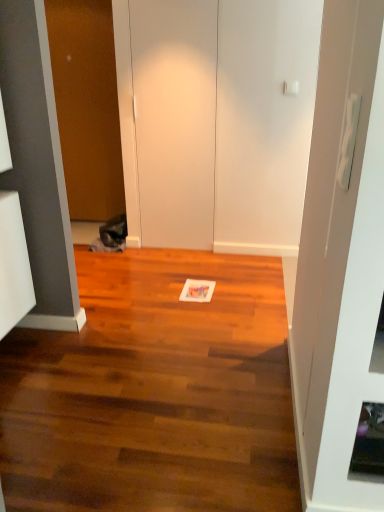
What do you see at coordinates (175, 119) in the screenshot? The height and width of the screenshot is (512, 384). I see `white matte door at center, marked as the 1th door in a right-to-left arrangement` at bounding box center [175, 119].

Where is `white matte door at center, the second door positioned from the left`? This screenshot has height=512, width=384. white matte door at center, the second door positioned from the left is located at coordinates (175, 119).

This screenshot has width=384, height=512. Describe the element at coordinates (87, 106) in the screenshot. I see `wooden door at left, which is counted as the 2th door, starting from the right` at that location.

In order to face wooden door at left, which is counted as the 2th door, starting from the right, should I rotate leftwards or rightwards?

It's best to rotate left around 14.013 degrees.

What are the coordinates of `wooden door at left, placed as the first door when sorted from left to right` in the screenshot? It's located at (87, 106).

The image size is (384, 512). What are the coordinates of `white matte door at center, marked as the 1th door in a right-to-left arrangement` in the screenshot? It's located at (175, 119).

Considering the relative positions of white matte door at center, marked as the 1th door in a right-to-left arrangement, and wooden door at left, placed as the first door when sorted from left to right, in the image provided, is white matte door at center, marked as the 1th door in a right-to-left arrangement, to the left or to the right of wooden door at left, placed as the first door when sorted from left to right,?

white matte door at center, marked as the 1th door in a right-to-left arrangement, is to the right of wooden door at left, placed as the first door when sorted from left to right.

Is white matte door at center, the second door positioned from the left, further to camera compared to wooden door at left, placed as the first door when sorted from left to right?

No, the depth of white matte door at center, the second door positioned from the left, is less than that of wooden door at left, placed as the first door when sorted from left to right.

Which point is more forward, (132, 1) or (92, 19)?

The point (132, 1) is in front.

From the image's perspective, is white matte door at center, the second door positioned from the left, beneath wooden door at left, placed as the first door when sorted from left to right?

Yes, from the image's perspective, white matte door at center, the second door positioned from the left, is below wooden door at left, placed as the first door when sorted from left to right.

Consider the image. From a real-world perspective, is white matte door at center, the second door positioned from the left, above or below wooden door at left, placed as the first door when sorted from left to right?

white matte door at center, the second door positioned from the left, is situated lower than wooden door at left, placed as the first door when sorted from left to right, in the real world.

Considering the sizes of objects white matte door at center, marked as the 1th door in a right-to-left arrangement, and wooden door at left, which is counted as the 2th door, starting from the right, in the image provided, who is wider, white matte door at center, marked as the 1th door in a right-to-left arrangement, or wooden door at left, which is counted as the 2th door, starting from the right,?

Wider between the two is wooden door at left, which is counted as the 2th door, starting from the right.

Is white matte door at center, the second door positioned from the left, shorter than wooden door at left, placed as the first door when sorted from left to right?

Yes.

Who is smaller, white matte door at center, marked as the 1th door in a right-to-left arrangement, or wooden door at left, which is counted as the 2th door, starting from the right?

white matte door at center, marked as the 1th door in a right-to-left arrangement.

Is white matte door at center, the second door positioned from the left, inside the boundaries of wooden door at left, which is counted as the 2th door, starting from the right, or outside?

white matte door at center, the second door positioned from the left, exists outside the volume of wooden door at left, which is counted as the 2th door, starting from the right.

Is white matte door at center, the second door positioned from the left, with wooden door at left, which is counted as the 2th door, starting from the right?

They are not placed beside each other.

Could you tell me if white matte door at center, marked as the 1th door in a right-to-left arrangement, is turned towards wooden door at left, which is counted as the 2th door, starting from the right?

No, white matte door at center, marked as the 1th door in a right-to-left arrangement, is not turned towards wooden door at left, which is counted as the 2th door, starting from the right.

Measure the distance between white matte door at center, the second door positioned from the left, and wooden door at left, which is counted as the 2th door, starting from the right.

white matte door at center, the second door positioned from the left, and wooden door at left, which is counted as the 2th door, starting from the right, are 34.08 inches apart.

The image size is (384, 512). Find the location of `door lying behind the white matte door at center, the second door positioned from the left`. door lying behind the white matte door at center, the second door positioned from the left is located at coordinates (87, 106).

Considering the positions of objects wooden door at left, placed as the first door when sorted from left to right, and white matte door at center, the second door positioned from the left, in the image provided, who is more to the right, wooden door at left, placed as the first door when sorted from left to right, or white matte door at center, the second door positioned from the left,?

From the viewer's perspective, white matte door at center, the second door positioned from the left, appears more on the right side.

Does wooden door at left, which is counted as the 2th door, starting from the right, lie in front of white matte door at center, the second door positioned from the left?

That is False.

Which is closer, (x=103, y=18) or (x=186, y=99)?

Point (x=103, y=18) appears to be farther away from the viewer than point (x=186, y=99).

From the image's perspective, is wooden door at left, which is counted as the 2th door, starting from the right, over white matte door at center, marked as the 1th door in a right-to-left arrangement?

Indeed, from the image's perspective, wooden door at left, which is counted as the 2th door, starting from the right, is shown above white matte door at center, marked as the 1th door in a right-to-left arrangement.

From a real-world perspective, which is physically above, wooden door at left, which is counted as the 2th door, starting from the right, or white matte door at center, marked as the 1th door in a right-to-left arrangement?

wooden door at left, which is counted as the 2th door, starting from the right, is physically above.

Can you confirm if wooden door at left, which is counted as the 2th door, starting from the right, is thinner than white matte door at center, the second door positioned from the left?

In fact, wooden door at left, which is counted as the 2th door, starting from the right, might be wider than white matte door at center, the second door positioned from the left.

Who is taller, wooden door at left, which is counted as the 2th door, starting from the right, or white matte door at center, marked as the 1th door in a right-to-left arrangement?

With more height is wooden door at left, which is counted as the 2th door, starting from the right.

Does wooden door at left, placed as the first door when sorted from left to right, have a larger size compared to white matte door at center, the second door positioned from the left?

Yes.

Which is correct: wooden door at left, placed as the first door when sorted from left to right, is inside white matte door at center, marked as the 1th door in a right-to-left arrangement, or outside of it?

The correct answer is: outside.

Are wooden door at left, placed as the first door when sorted from left to right, and white matte door at center, marked as the 1th door in a right-to-left arrangement, located far from each other?

No, wooden door at left, placed as the first door when sorted from left to right, is not far away from white matte door at center, marked as the 1th door in a right-to-left arrangement.

Does wooden door at left, which is counted as the 2th door, starting from the right, turn towards white matte door at center, marked as the 1th door in a right-to-left arrangement?

No, wooden door at left, which is counted as the 2th door, starting from the right, is not oriented towards white matte door at center, marked as the 1th door in a right-to-left arrangement.

What's the angular difference between wooden door at left, which is counted as the 2th door, starting from the right, and white matte door at center, marked as the 1th door in a right-to-left arrangement,'s facing directions?

They differ by 0.000278 degrees in their facing directions.

Image resolution: width=384 pixels, height=512 pixels. Find the location of `door on the left of white matte door at center, the second door positioned from the left`. door on the left of white matte door at center, the second door positioned from the left is located at coordinates (87, 106).

This screenshot has width=384, height=512. In order to click on door that appears below the wooden door at left, placed as the first door when sorted from left to right (from the image's perspective) in this screenshot , I will do coord(175,119).

What are the coordinates of `door on the right of wooden door at left, placed as the first door when sorted from left to right` in the screenshot? It's located at (175, 119).